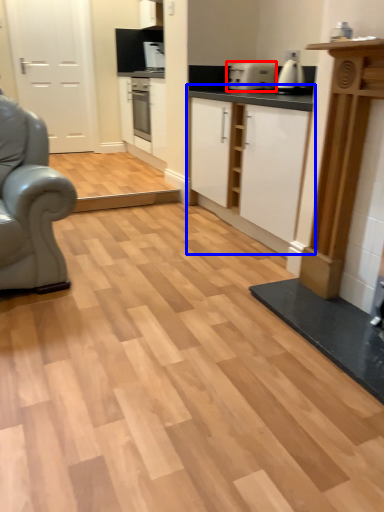
Question: Which object appears closest to the camera in this image, appliance (highlighted by a red box) or cabinetry (highlighted by a blue box)?

Choices:
 (A) appliance
 (B) cabinetry

Answer: (B)